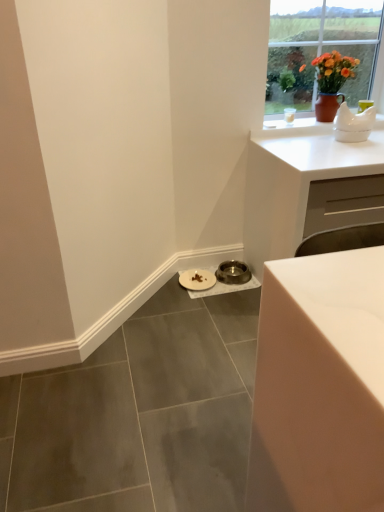
Question: Considering the relative positions of metallic silver bowl at lower center, the second manhole cover in the left-to-right sequence, and white ceramic teapot at upper right in the image provided, is metallic silver bowl at lower center, the second manhole cover in the left-to-right sequence, to the left of white ceramic teapot at upper right from the viewer's perspective?

Choices:
 (A) yes
 (B) no

Answer: (A)

Question: Is metallic silver bowl at lower center, which is counted as the first manhole cover, starting from the right, turned away from white ceramic teapot at upper right?

Choices:
 (A) yes
 (B) no

Answer: (B)

Question: From a real-world perspective, is metallic silver bowl at lower center, the second manhole cover in the left-to-right sequence, below white ceramic teapot at upper right?

Choices:
 (A) yes
 (B) no

Answer: (A)

Question: Is metallic silver bowl at lower center, the second manhole cover in the left-to-right sequence, not within white ceramic teapot at upper right?

Choices:
 (A) yes
 (B) no

Answer: (A)

Question: Is metallic silver bowl at lower center, which is counted as the first manhole cover, starting from the right, positioned in front of white ceramic teapot at upper right?

Choices:
 (A) yes
 (B) no

Answer: (B)

Question: Is matte brown vase at upper right bigger or smaller than white matte cabinet at upper right?

Choices:
 (A) big
 (B) small

Answer: (B)

Question: From a real-world perspective, is matte brown vase at upper right positioned above or below white matte cabinet at upper right?

Choices:
 (A) above
 (B) below

Answer: (A)

Question: Considering the positions of matte brown vase at upper right and white matte cabinet at upper right in the image, is matte brown vase at upper right taller or shorter than white matte cabinet at upper right?

Choices:
 (A) short
 (B) tall

Answer: (A)

Question: Relative to white matte cabinet at upper right, is matte brown vase at upper right in front or behind?

Choices:
 (A) front
 (B) behind

Answer: (B)

Question: Is point (359, 411) positioned closer to the camera than point (273, 129)?

Choices:
 (A) closer
 (B) farther

Answer: (A)

Question: Looking at their shapes, would you say white glossy table at lower right is wider or thinner than white ceramic teapot at upper right?

Choices:
 (A) wide
 (B) thin

Answer: (B)

Question: In terms of size, does white glossy table at lower right appear bigger or smaller than white ceramic teapot at upper right?

Choices:
 (A) small
 (B) big

Answer: (B)

Question: In terms of height, does white glossy table at lower right look taller or shorter compared to white ceramic teapot at upper right?

Choices:
 (A) tall
 (B) short

Answer: (A)

Question: Would you say metallic silver bowl at lower center, the second manhole cover in the left-to-right sequence, is inside or outside white matte plate at lower center, which is the 2th manhole cover in right-to-left order?

Choices:
 (A) inside
 (B) outside

Answer: (B)

Question: In the image, is metallic silver bowl at lower center, which is counted as the first manhole cover, starting from the right, on the left side or the right side of white matte plate at lower center, which is counted as the 1th manhole cover, starting from the left?

Choices:
 (A) left
 (B) right

Answer: (B)